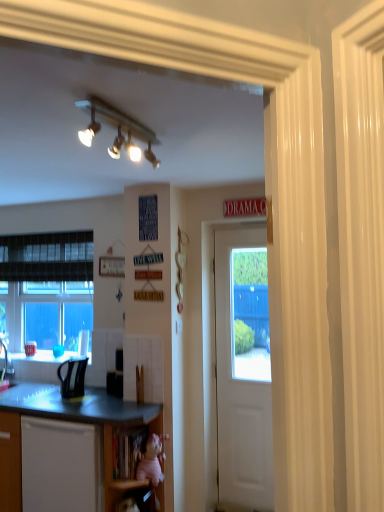
Image resolution: width=384 pixels, height=512 pixels. I want to click on vacant area that lies in front of black matte microwave oven at lower center, so click(110, 395).